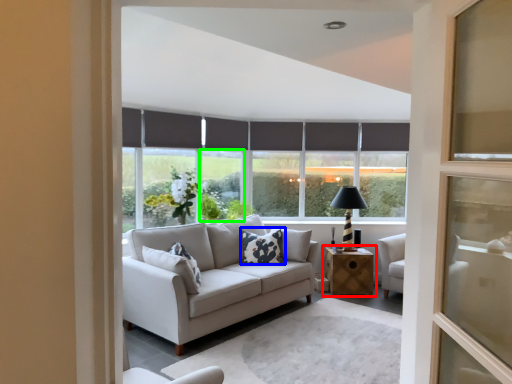
Question: Which object is the farthest from table (highlighted by a red box)? Choose among these: pillow (highlighted by a blue box) or window (highlighted by a green box).

Choices:
 (A) pillow
 (B) window

Answer: (B)